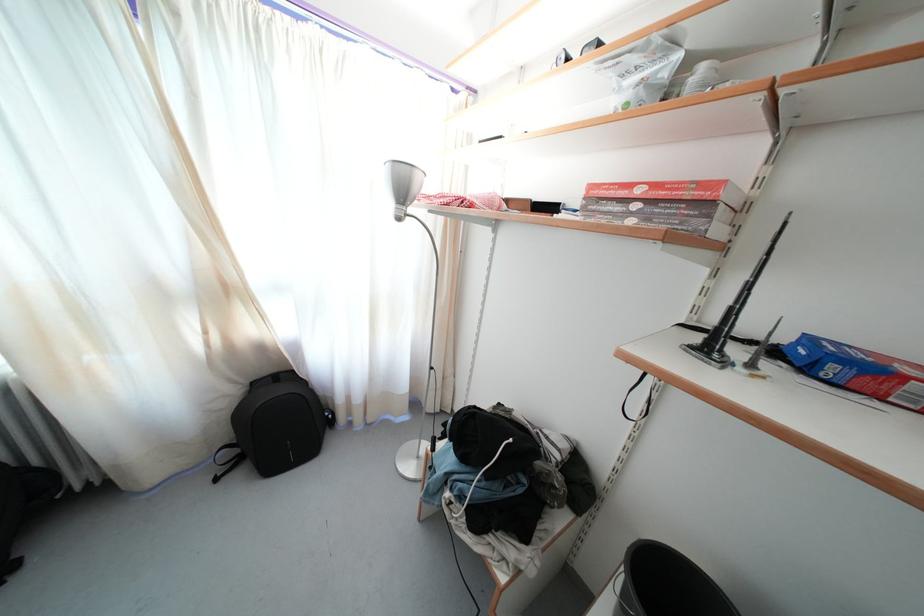
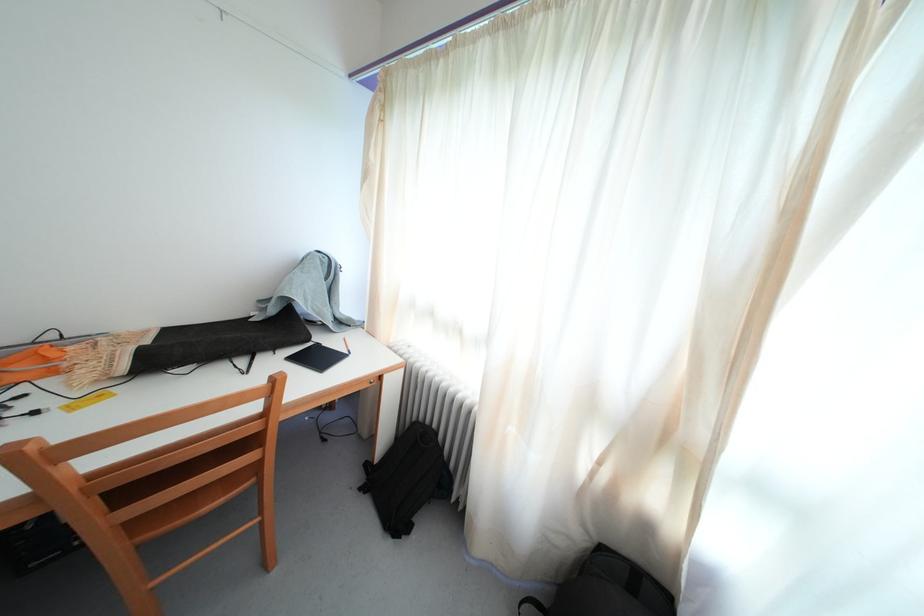
Question: The first image is from the beginning of the video and the second image is from the end. How did the camera likely rotate when shooting the video?

Choices:
 (A) Left
 (B) Right
 (C) Up
 (D) Down

Answer: (A)